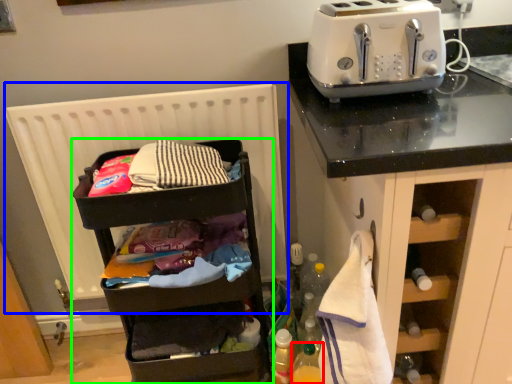
Question: Estimate the real-world distances between objects in this image. Which object is closer to bottle (highlighted by a red box), radiator (highlighted by a blue box) or shelf (highlighted by a green box)?

Choices:
 (A) radiator
 (B) shelf

Answer: (B)